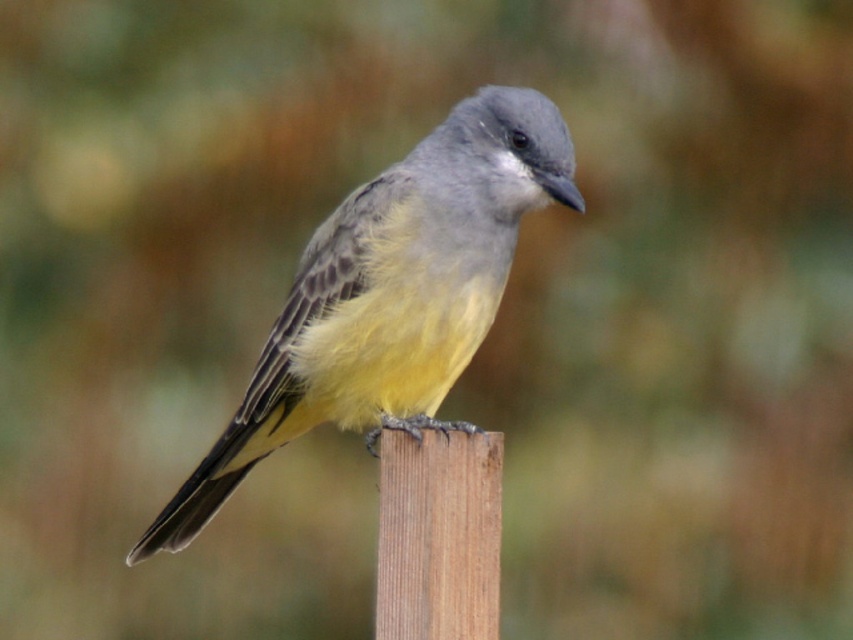
Which of these two, yellow-gray feathers at center or brown wood pole at center, stands taller?

With more height is yellow-gray feathers at center.

Can you confirm if yellow-gray feathers at center is smaller than brown wood pole at center?

No, yellow-gray feathers at center is not smaller than brown wood pole at center.

Who is more distant from viewer, (398, 266) or (468, 582)?

Positioned behind is point (398, 266).

Identify the location of yellow-gray feathers at center. (390, 294).